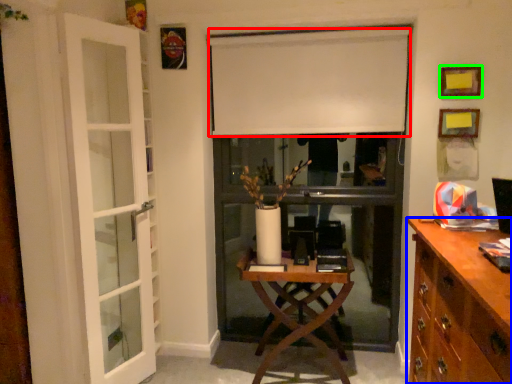
Question: Which object is positioned closest to curtain (highlighted by a red box)? Select from cabinetry (highlighted by a blue box) and picture frame (highlighted by a green box).

Choices:
 (A) cabinetry
 (B) picture frame

Answer: (B)